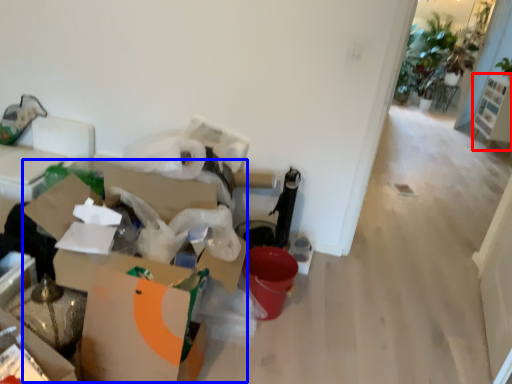
Question: Which object is further to the camera taking this photo, furniture (highlighted by a red box) or cardboard box (highlighted by a blue box)?

Choices:
 (A) furniture
 (B) cardboard box

Answer: (A)